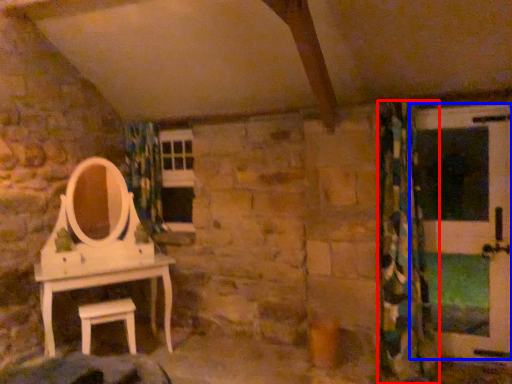
Question: Which of the following is the closest to the observer, curtain (highlighted by a red box) or screen door (highlighted by a blue box)?

Choices:
 (A) curtain
 (B) screen door

Answer: (A)